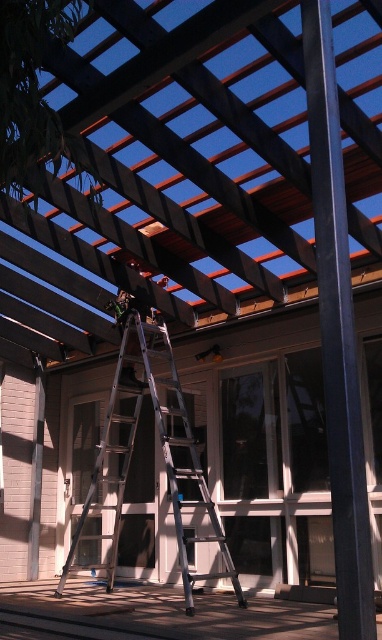
Between wooden deck at lower center and silver metallic ladder at center, which one has less height?

Result: wooden deck at lower center

Does wooden deck at lower center have a larger size compared to silver metallic ladder at center?

Actually, wooden deck at lower center might be smaller than silver metallic ladder at center.

Is point (119, 632) positioned behind point (111, 589)?

No, it is not.

Where is `wooden deck at lower center`? This screenshot has height=640, width=382. wooden deck at lower center is located at coordinates (160, 612).

Is dark brown wooden beams at center smaller than silver metallic ladder at center?

Yes.

This screenshot has height=640, width=382. Find the location of `dark brown wooden beams at center`. dark brown wooden beams at center is located at coordinates tap(165, 170).

Find the location of a particular element. The image size is (382, 640). dark brown wooden beams at center is located at coordinates (165, 170).

Who is taller, dark brown wooden beams at center or wooden deck at lower center?

dark brown wooden beams at center

Is dark brown wooden beams at center to the right of wooden deck at lower center from the viewer's perspective?

Yes, dark brown wooden beams at center is to the right of wooden deck at lower center.

Who is more forward, [223,276] or [163,605]?

Positioned in front is point [163,605].

The height and width of the screenshot is (640, 382). Identify the location of dark brown wooden beams at center. (165, 170).